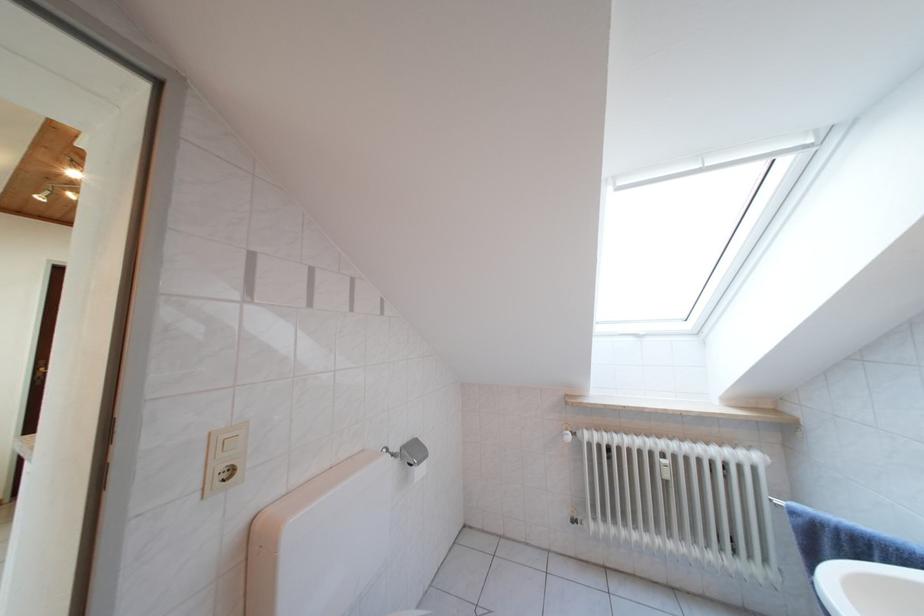
Find where to turn the radiator control knob. Please return your answer as a coordinate pair (x, y).

(581, 438)